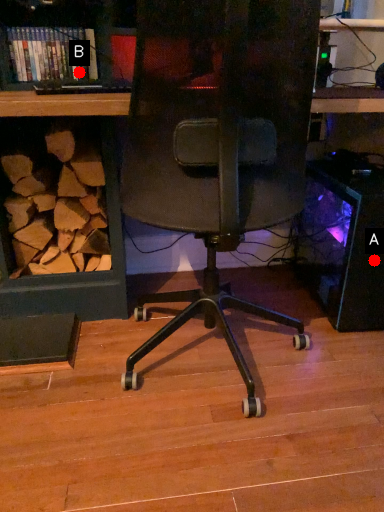
Question: Two points are circled on the image, labeled by A and B beside each circle. Which point is further to the camera?

Choices:
 (A) A is further
 (B) B is further

Answer: (B)